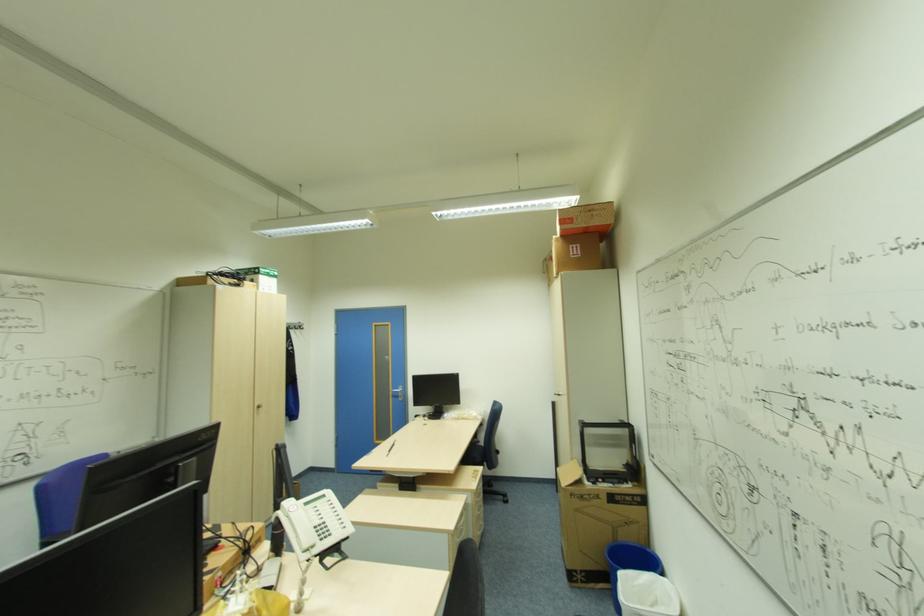
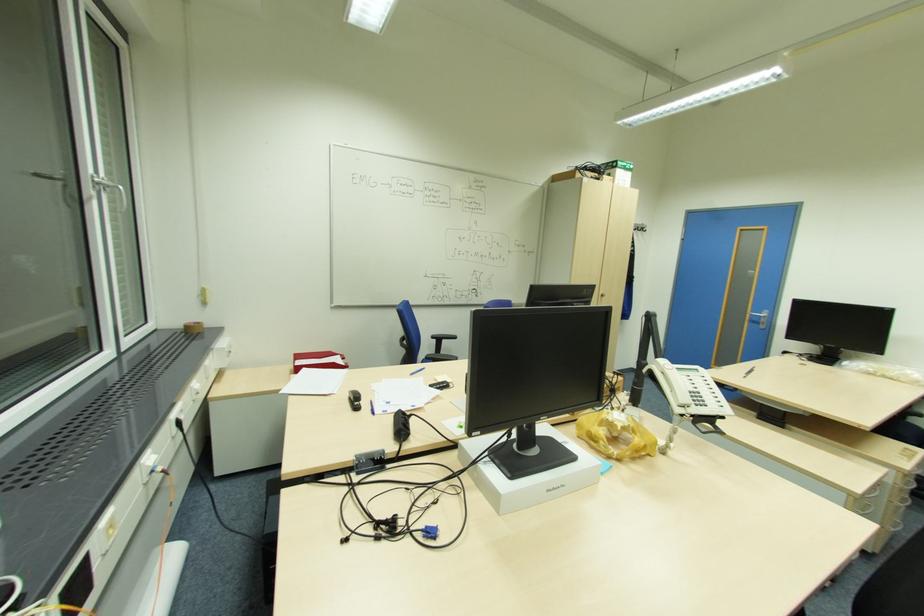
Locate, in the second image, the point that corresponds to pixel 324 540 in the first image.

(699, 403)